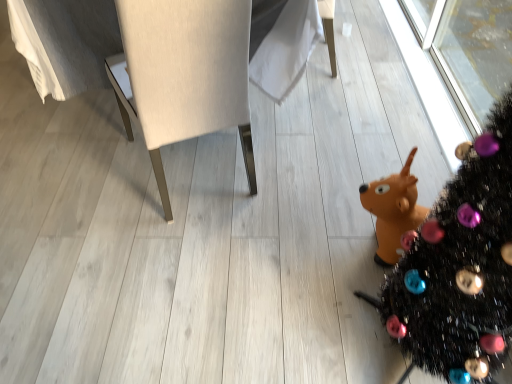
Question: Can you confirm if black glittery christmas tree at lower right is bigger than matte white chair at center?

Choices:
 (A) yes
 (B) no

Answer: (B)

Question: Can you confirm if black glittery christmas tree at lower right is thinner than matte white chair at center?

Choices:
 (A) yes
 (B) no

Answer: (A)

Question: From the image's perspective, is black glittery christmas tree at lower right on top of matte white chair at center?

Choices:
 (A) yes
 (B) no

Answer: (B)

Question: From a real-world perspective, is black glittery christmas tree at lower right over matte white chair at center?

Choices:
 (A) no
 (B) yes

Answer: (B)

Question: From the image's perspective, is black glittery christmas tree at lower right under matte white chair at center?

Choices:
 (A) yes
 (B) no

Answer: (A)

Question: Considering the relative sizes of black glittery christmas tree at lower right and matte white chair at center in the image provided, is black glittery christmas tree at lower right shorter than matte white chair at center?

Choices:
 (A) no
 (B) yes

Answer: (A)

Question: Considering the relative positions of matte white chair at center and black glittery christmas tree at lower right in the image provided, is matte white chair at center to the left of black glittery christmas tree at lower right from the viewer's perspective?

Choices:
 (A) yes
 (B) no

Answer: (A)

Question: Can you confirm if matte white chair at center is wider than black glittery christmas tree at lower right?

Choices:
 (A) yes
 (B) no

Answer: (A)

Question: Does matte white chair at center lie in front of black glittery christmas tree at lower right?

Choices:
 (A) yes
 (B) no

Answer: (B)

Question: Considering the relative sizes of matte white chair at center and black glittery christmas tree at lower right in the image provided, is matte white chair at center smaller than black glittery christmas tree at lower right?

Choices:
 (A) no
 (B) yes

Answer: (A)

Question: From a real-world perspective, is matte white chair at center over black glittery christmas tree at lower right?

Choices:
 (A) yes
 (B) no

Answer: (B)

Question: Would you say matte white chair at center contains black glittery christmas tree at lower right?

Choices:
 (A) no
 (B) yes

Answer: (A)

Question: Considering the positions of matte white chair at center and black glittery christmas tree at lower right in the image, is matte white chair at center wider or thinner than black glittery christmas tree at lower right?

Choices:
 (A) thin
 (B) wide

Answer: (B)